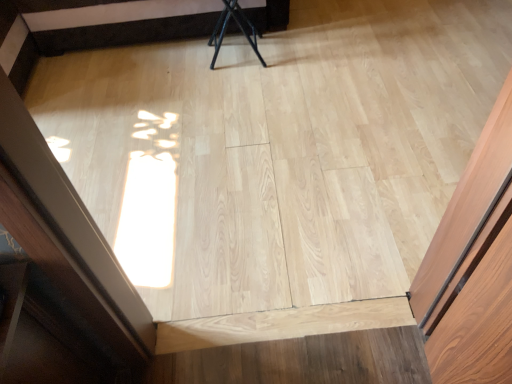
Locate an element on the screen. This screenshot has width=512, height=384. free spot to the right of black metal tripod at upper center is located at coordinates (289, 54).